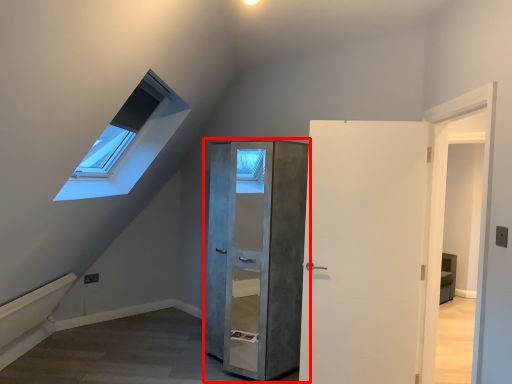
Question: Considering the relative positions of cupboard (annotated by the red box) and door in the image provided, where is cupboard (annotated by the red box) located with respect to the staircase?

Choices:
 (A) left
 (B) right

Answer: (A)